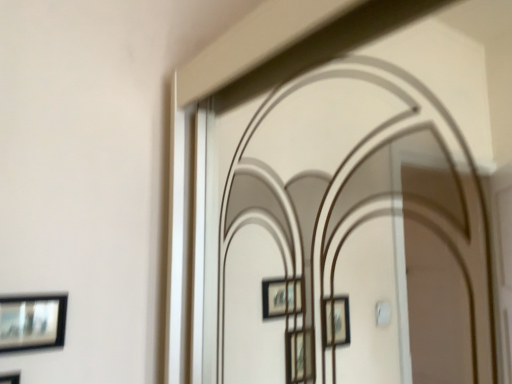
The image size is (512, 384). What are the coordinates of `matte black picture frame at lower left, the 2th picture frame in the bottom-to-top sequence` in the screenshot? It's located at (32, 322).

What do you see at coordinates (32, 322) in the screenshot? This screenshot has width=512, height=384. I see `matte black picture frame at lower left, placed as the 1th picture frame when sorted from top to bottom` at bounding box center [32, 322].

How much space does matte black picture frame at lower left, which appears as the 2th picture frame when viewed from the top, occupy horizontally?

The width of matte black picture frame at lower left, which appears as the 2th picture frame when viewed from the top, is 1.37 inches.

Identify the location of matte black picture frame at lower left, which appears as the 2th picture frame when viewed from the top. The width and height of the screenshot is (512, 384). (10, 377).

What do you see at coordinates (10, 377) in the screenshot?
I see `matte black picture frame at lower left, which is the first picture frame in bottom-to-top order` at bounding box center [10, 377].

The height and width of the screenshot is (384, 512). I want to click on matte black picture frame at lower left, placed as the 1th picture frame when sorted from top to bottom, so click(x=32, y=322).

In the scene shown: Is matte black picture frame at lower left, which appears as the 2th picture frame when viewed from the top, at the left side of matte black picture frame at lower left, the 2th picture frame in the bottom-to-top sequence?

Yes.

Is matte black picture frame at lower left, which appears as the 2th picture frame when viewed from the top, positioned behind matte black picture frame at lower left, placed as the 1th picture frame when sorted from top to bottom?

No, it is in front of matte black picture frame at lower left, placed as the 1th picture frame when sorted from top to bottom.

Does point (17, 375) appear closer or farther from the camera than point (2, 303)?

Point (17, 375) is positioned farther from the camera compared to point (2, 303).

From the image's perspective, is matte black picture frame at lower left, which is the first picture frame in bottom-to-top order, located above or below matte black picture frame at lower left, placed as the 1th picture frame when sorted from top to bottom?

matte black picture frame at lower left, which is the first picture frame in bottom-to-top order, is below matte black picture frame at lower left, placed as the 1th picture frame when sorted from top to bottom.

From a real-world perspective, between matte black picture frame at lower left, which is the first picture frame in bottom-to-top order, and matte black picture frame at lower left, placed as the 1th picture frame when sorted from top to bottom, who is vertically higher?

In real-world perspective, matte black picture frame at lower left, placed as the 1th picture frame when sorted from top to bottom, is above.

Which of these two, matte black picture frame at lower left, which appears as the 2th picture frame when viewed from the top, or matte black picture frame at lower left, the 2th picture frame in the bottom-to-top sequence, is wider?

Wider between the two is matte black picture frame at lower left, which appears as the 2th picture frame when viewed from the top.

Consider the image. Which of these two, matte black picture frame at lower left, which is the first picture frame in bottom-to-top order, or matte black picture frame at lower left, placed as the 1th picture frame when sorted from top to bottom, stands shorter?

matte black picture frame at lower left, placed as the 1th picture frame when sorted from top to bottom, is shorter.

Looking at the image, does matte black picture frame at lower left, which appears as the 2th picture frame when viewed from the top, seem bigger or smaller compared to matte black picture frame at lower left, the 2th picture frame in the bottom-to-top sequence?

Considering their sizes, matte black picture frame at lower left, which appears as the 2th picture frame when viewed from the top, takes up more space than matte black picture frame at lower left, the 2th picture frame in the bottom-to-top sequence.

Is matte black picture frame at lower left, which appears as the 2th picture frame when viewed from the top, inside or outside of matte black picture frame at lower left, placed as the 1th picture frame when sorted from top to bottom?

matte black picture frame at lower left, which appears as the 2th picture frame when viewed from the top, is not enclosed by matte black picture frame at lower left, placed as the 1th picture frame when sorted from top to bottom.

Is matte black picture frame at lower left, which is the first picture frame in bottom-to-top order, next to matte black picture frame at lower left, the 2th picture frame in the bottom-to-top sequence?

No, matte black picture frame at lower left, which is the first picture frame in bottom-to-top order, is not with matte black picture frame at lower left, the 2th picture frame in the bottom-to-top sequence.

Is matte black picture frame at lower left, which is the first picture frame in bottom-to-top order, facing towards matte black picture frame at lower left, the 2th picture frame in the bottom-to-top sequence?

No, matte black picture frame at lower left, which is the first picture frame in bottom-to-top order, is not oriented towards matte black picture frame at lower left, the 2th picture frame in the bottom-to-top sequence.

The height and width of the screenshot is (384, 512). Find the location of `picture frame lying below the matte black picture frame at lower left, the 2th picture frame in the bottom-to-top sequence (from the image's perspective)`. picture frame lying below the matte black picture frame at lower left, the 2th picture frame in the bottom-to-top sequence (from the image's perspective) is located at coordinates (10, 377).

Which is more to the right, matte black picture frame at lower left, the 2th picture frame in the bottom-to-top sequence, or matte black picture frame at lower left, which is the first picture frame in bottom-to-top order?

matte black picture frame at lower left, the 2th picture frame in the bottom-to-top sequence, is more to the right.

Is matte black picture frame at lower left, the 2th picture frame in the bottom-to-top sequence, further to camera compared to matte black picture frame at lower left, which appears as the 2th picture frame when viewed from the top?

Yes, matte black picture frame at lower left, the 2th picture frame in the bottom-to-top sequence, is behind matte black picture frame at lower left, which appears as the 2th picture frame when viewed from the top.

Considering the positions of points (44, 309) and (10, 379), is point (44, 309) closer to camera compared to point (10, 379)?

No, (44, 309) is further to viewer.

From the image's perspective, which object appears higher, matte black picture frame at lower left, placed as the 1th picture frame when sorted from top to bottom, or matte black picture frame at lower left, which is the first picture frame in bottom-to-top order?

matte black picture frame at lower left, placed as the 1th picture frame when sorted from top to bottom, from the image's perspective.

From a real-world perspective, between matte black picture frame at lower left, the 2th picture frame in the bottom-to-top sequence, and matte black picture frame at lower left, which appears as the 2th picture frame when viewed from the top, who is vertically higher?

In real-world perspective, matte black picture frame at lower left, the 2th picture frame in the bottom-to-top sequence, is above.

Between matte black picture frame at lower left, the 2th picture frame in the bottom-to-top sequence, and matte black picture frame at lower left, which appears as the 2th picture frame when viewed from the top, which one has smaller width?

matte black picture frame at lower left, the 2th picture frame in the bottom-to-top sequence, is thinner.

Which of these two, matte black picture frame at lower left, the 2th picture frame in the bottom-to-top sequence, or matte black picture frame at lower left, which appears as the 2th picture frame when viewed from the top, stands taller?

matte black picture frame at lower left, which appears as the 2th picture frame when viewed from the top.

In terms of size, does matte black picture frame at lower left, placed as the 1th picture frame when sorted from top to bottom, appear bigger or smaller than matte black picture frame at lower left, which appears as the 2th picture frame when viewed from the top?

Considering their sizes, matte black picture frame at lower left, placed as the 1th picture frame when sorted from top to bottom, takes up less space than matte black picture frame at lower left, which appears as the 2th picture frame when viewed from the top.

Is matte black picture frame at lower left, placed as the 1th picture frame when sorted from top to bottom, not within matte black picture frame at lower left, which appears as the 2th picture frame when viewed from the top?

matte black picture frame at lower left, placed as the 1th picture frame when sorted from top to bottom, is positioned outside matte black picture frame at lower left, which appears as the 2th picture frame when viewed from the top.

Does matte black picture frame at lower left, placed as the 1th picture frame when sorted from top to bottom, touch matte black picture frame at lower left, which appears as the 2th picture frame when viewed from the top?

No, matte black picture frame at lower left, placed as the 1th picture frame when sorted from top to bottom, is not touching matte black picture frame at lower left, which appears as the 2th picture frame when viewed from the top.

Is matte black picture frame at lower left, placed as the 1th picture frame when sorted from top to bottom, turned away from matte black picture frame at lower left, which appears as the 2th picture frame when viewed from the top?

No.

Could you measure the distance between matte black picture frame at lower left, the 2th picture frame in the bottom-to-top sequence, and matte black picture frame at lower left, which is the first picture frame in bottom-to-top order?

matte black picture frame at lower left, the 2th picture frame in the bottom-to-top sequence, and matte black picture frame at lower left, which is the first picture frame in bottom-to-top order, are 4.56 inches apart from each other.

I want to click on picture frame that is on the right side of matte black picture frame at lower left, which appears as the 2th picture frame when viewed from the top, so click(32, 322).

Locate an element on the screen. Image resolution: width=512 pixels, height=384 pixels. picture frame on the right side of matte black picture frame at lower left, which appears as the 2th picture frame when viewed from the top is located at coordinates (32, 322).

Locate an element on the screen. picture frame lying on the left of matte black picture frame at lower left, the 2th picture frame in the bottom-to-top sequence is located at coordinates (10, 377).